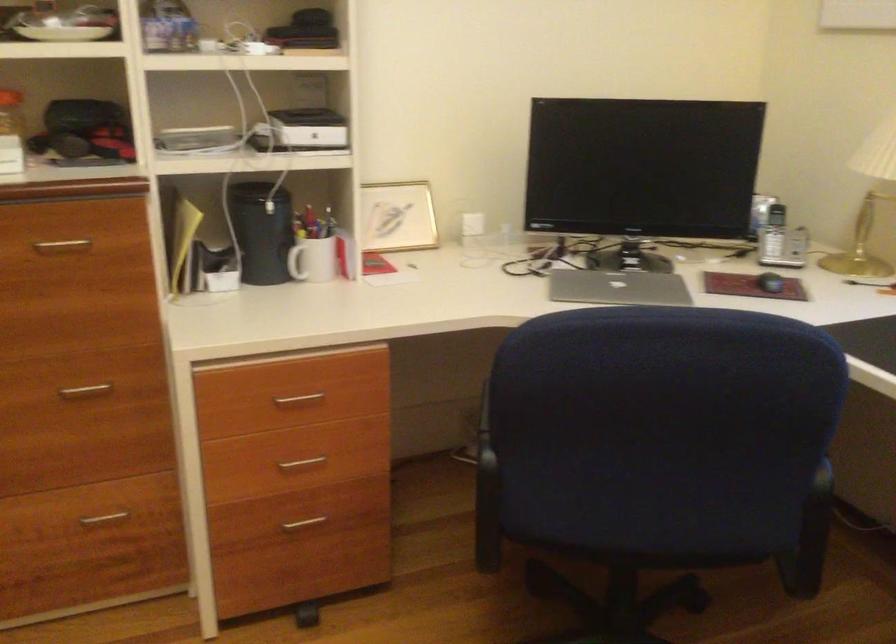
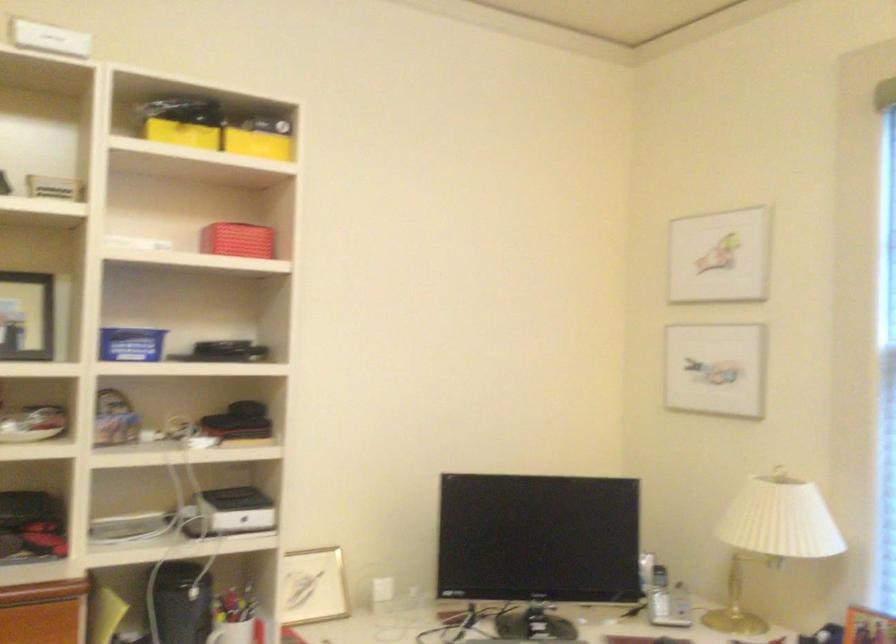
Find the pixel in the second image that matches pixel 763 232 in the first image.

(659, 594)